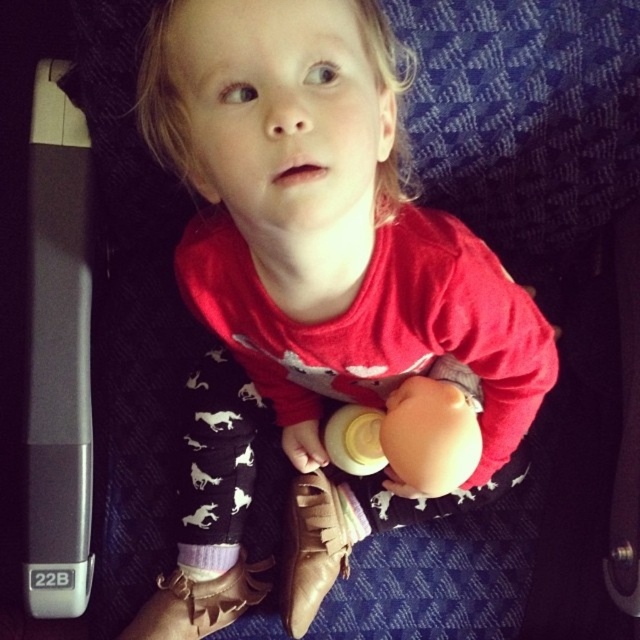
Question: Estimate the real-world distances between objects in this image. Which object is farther from the pink suede shoe at lower center?

Choices:
 (A) leather shoe at center
 (B) white plastic bottle at center

Answer: (B)

Question: Can you confirm if leather shoe at center is thinner than purple knitted sock at lower center?

Choices:
 (A) no
 (B) yes

Answer: (A)

Question: Can you confirm if leather shoe at center is positioned above white plastic bottle at center?

Choices:
 (A) no
 (B) yes

Answer: (A)

Question: Which of the following is the closest to the observer?

Choices:
 (A) (364, 451)
 (B) (184, 518)
 (C) (289, 598)
 (D) (218, 563)

Answer: (A)

Question: Is pink suede shoe at lower center positioned at the back of white plastic bottle at center?

Choices:
 (A) no
 (B) yes

Answer: (B)

Question: Which point appears closest to the camera in this image?

Choices:
 (A) (352, 419)
 (B) (221, 568)
 (C) (228, 616)

Answer: (A)